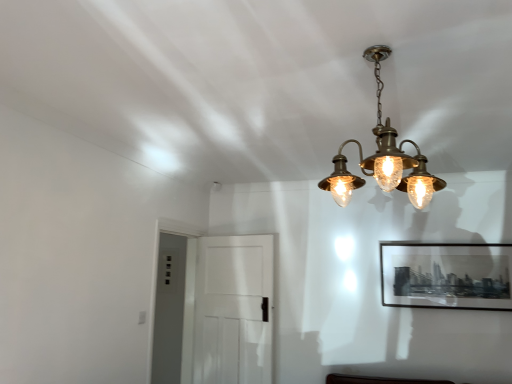
Question: Is black matte picture frame at upper right facing towards white matte door at center?

Choices:
 (A) no
 (B) yes

Answer: (A)

Question: Does black matte picture frame at upper right have a greater width compared to white matte door at center?

Choices:
 (A) yes
 (B) no

Answer: (B)

Question: Does black matte picture frame at upper right have a smaller size compared to white matte door at center?

Choices:
 (A) no
 (B) yes

Answer: (B)

Question: Is black matte picture frame at upper right at the left side of white matte door at center?

Choices:
 (A) yes
 (B) no

Answer: (B)

Question: Can you confirm if black matte picture frame at upper right is taller than white matte door at center?

Choices:
 (A) yes
 (B) no

Answer: (B)

Question: Considering the positions of black matte picture frame at upper right and white matte door at center in the image, is black matte picture frame at upper right bigger or smaller than white matte door at center?

Choices:
 (A) small
 (B) big

Answer: (A)

Question: From a real-world perspective, relative to white matte door at center, is black matte picture frame at upper right vertically above or below?

Choices:
 (A) above
 (B) below

Answer: (A)

Question: Would you say black matte picture frame at upper right is to the left or to the right of white matte door at center in the picture?

Choices:
 (A) right
 (B) left

Answer: (A)

Question: Relative to white matte door at center, is black matte picture frame at upper right in front or behind?

Choices:
 (A) behind
 (B) front

Answer: (A)

Question: Is white matte door at center spatially inside brass/bronze chandelier at upper center, or outside of it?

Choices:
 (A) outside
 (B) inside

Answer: (A)

Question: Is point (269, 355) positioned closer to the camera than point (326, 180)?

Choices:
 (A) farther
 (B) closer

Answer: (B)

Question: Is white matte door at center bigger or smaller than brass/bronze chandelier at upper center?

Choices:
 (A) big
 (B) small

Answer: (A)

Question: Considering the positions of white matte door at center and brass/bronze chandelier at upper center in the image, is white matte door at center taller or shorter than brass/bronze chandelier at upper center?

Choices:
 (A) tall
 (B) short

Answer: (A)

Question: Considering their positions, is brass/bronze chandelier at upper center located in front of or behind white matte door at center?

Choices:
 (A) front
 (B) behind

Answer: (A)

Question: From their relative heights in the image, would you say brass/bronze chandelier at upper center is taller or shorter than white matte door at center?

Choices:
 (A) short
 (B) tall

Answer: (A)